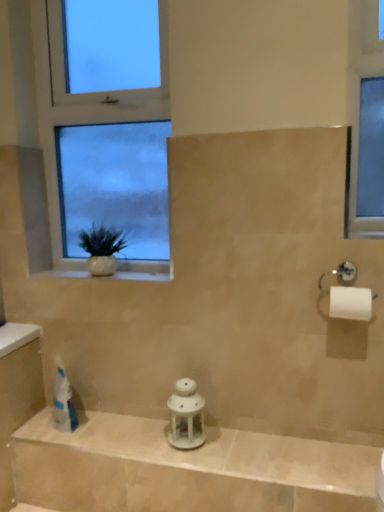
Question: Is white glossy lantern at center at the left side of white glass window at upper left?

Choices:
 (A) no
 (B) yes

Answer: (A)

Question: Does white glossy lantern at center come behind white glass window at upper left?

Choices:
 (A) yes
 (B) no

Answer: (B)

Question: Can you confirm if white glossy lantern at center is taller than white glass window at upper left?

Choices:
 (A) no
 (B) yes

Answer: (A)

Question: Is the depth of white glossy lantern at center less than that of white glass window at upper left?

Choices:
 (A) no
 (B) yes

Answer: (B)

Question: Would you say white glossy lantern at center contains white glass window at upper left?

Choices:
 (A) no
 (B) yes

Answer: (A)

Question: Is white glossy lantern at center not close to white glass window at upper left?

Choices:
 (A) no
 (B) yes

Answer: (A)

Question: Considering the relative positions of white ceramic vase at left and white glass window at upper left in the image provided, is white ceramic vase at left behind white glass window at upper left?

Choices:
 (A) yes
 (B) no

Answer: (A)

Question: Is white ceramic vase at left not near white glass window at upper left?

Choices:
 (A) yes
 (B) no

Answer: (B)

Question: From the image's perspective, is white ceramic vase at left on white glass window at upper left?

Choices:
 (A) yes
 (B) no

Answer: (B)

Question: Is the depth of white ceramic vase at left less than that of white glass window at upper left?

Choices:
 (A) no
 (B) yes

Answer: (A)

Question: Does white ceramic vase at left have a lesser width compared to white glass window at upper left?

Choices:
 (A) yes
 (B) no

Answer: (B)

Question: Is white ceramic vase at left facing away from white glass window at upper left?

Choices:
 (A) yes
 (B) no

Answer: (B)

Question: Considering the relative positions of white glass window at upper left and white ceramic vase at left in the image provided, is white glass window at upper left to the right of white ceramic vase at left from the viewer's perspective?

Choices:
 (A) no
 (B) yes

Answer: (A)